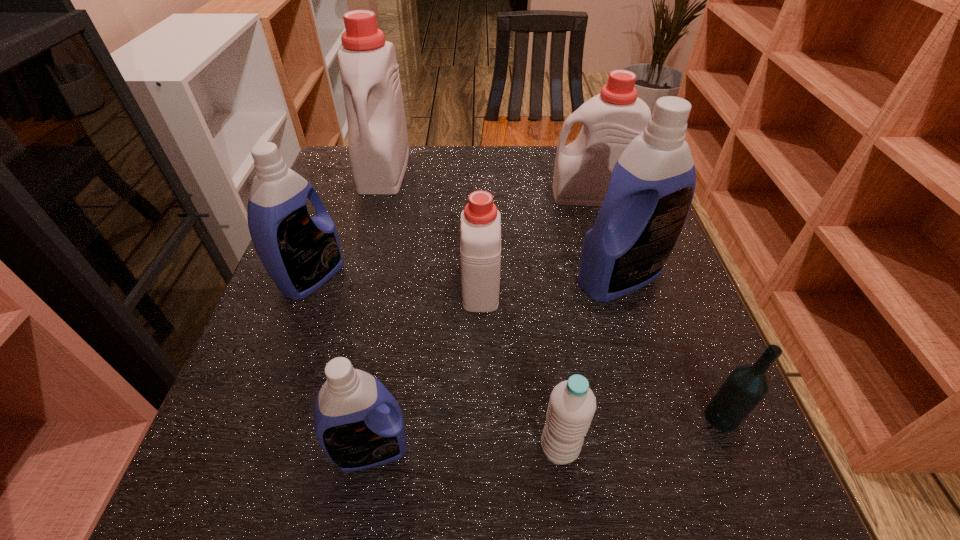
Where is `the biggest white detergent`? The height and width of the screenshot is (540, 960). the biggest white detergent is located at coordinates (377, 132).

Where is `the rightmost blue detergent`? The width and height of the screenshot is (960, 540). the rightmost blue detergent is located at coordinates (652, 185).

At what (x,y) coordinates should I click in order to perform the action: click on the second biggest blue detergent. Please return your answer as a coordinate pair (x, y). This screenshot has width=960, height=540. Looking at the image, I should click on (300, 253).

Where is `the second biggest white detergent`? The width and height of the screenshot is (960, 540). the second biggest white detergent is located at coordinates (612, 119).

Where is `the smallest white detergent`? The image size is (960, 540). the smallest white detergent is located at coordinates (480, 231).

Locate an element on the screen. Image resolution: width=960 pixels, height=540 pixels. the third detergent from right to left is located at coordinates (480, 231).

Image resolution: width=960 pixels, height=540 pixels. What are the coordinates of `the smallest blue detergent` in the screenshot? It's located at (358, 423).

The height and width of the screenshot is (540, 960). Identify the location of the nearest detergent. (358, 423).

The image size is (960, 540). Identify the location of black vodka. (747, 385).

You are a GUI agent. You are given a task and a screenshot of the screen. Output one action in this format:
    pyautogui.click(x=<x>, y=<y>)
    Task: Click on the white water bottle
    Image resolution: width=960 pixels, height=540 pixels.
    Given the screenshot: What is the action you would take?
    pyautogui.click(x=572, y=404)